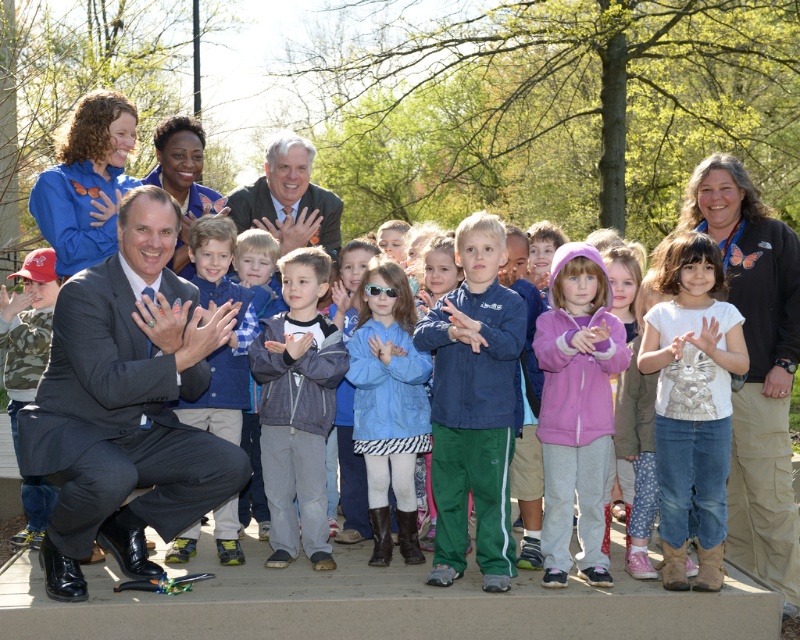
Which is behind, point (100, 324) or point (570, 472)?

Positioned behind is point (570, 472).

Can you confirm if dark gray suit at center is wider than purple fleece jacket at center?

Yes.

At what (x,y) coordinates should I click in order to perform the action: click on dark gray suit at center. Please return your answer as a coordinate pair (x, y). This screenshot has width=800, height=640. Looking at the image, I should click on (126, 404).

The height and width of the screenshot is (640, 800). In order to click on dark gray suit at center in this screenshot , I will do `click(126, 404)`.

Who is taller, dark gray suit at center or blue plaid shirt at center?

Standing taller between the two is dark gray suit at center.

Is dark gray suit at center shorter than blue plaid shirt at center?

No.

Is point (178, 525) positioned in front of point (236, 515)?

Yes.

You are a GUI agent. You are given a task and a screenshot of the screen. Output one action in this format:
    pyautogui.click(x=<x>, y=<y>)
    Task: Click on the dark gray suit at center
    
    Given the screenshot: What is the action you would take?
    pyautogui.click(x=126, y=404)

Can you confirm if gray fleece jacket at center is wider than blue plaid shirt at center?

Indeed, gray fleece jacket at center has a greater width compared to blue plaid shirt at center.

Is point (289, 284) positioned in front of point (228, 499)?

No, (289, 284) is behind (228, 499).

Which is behind, point (314, 556) or point (200, 276)?

The point (200, 276) is more distant.

The height and width of the screenshot is (640, 800). Identify the location of gray fleece jacket at center. (297, 406).